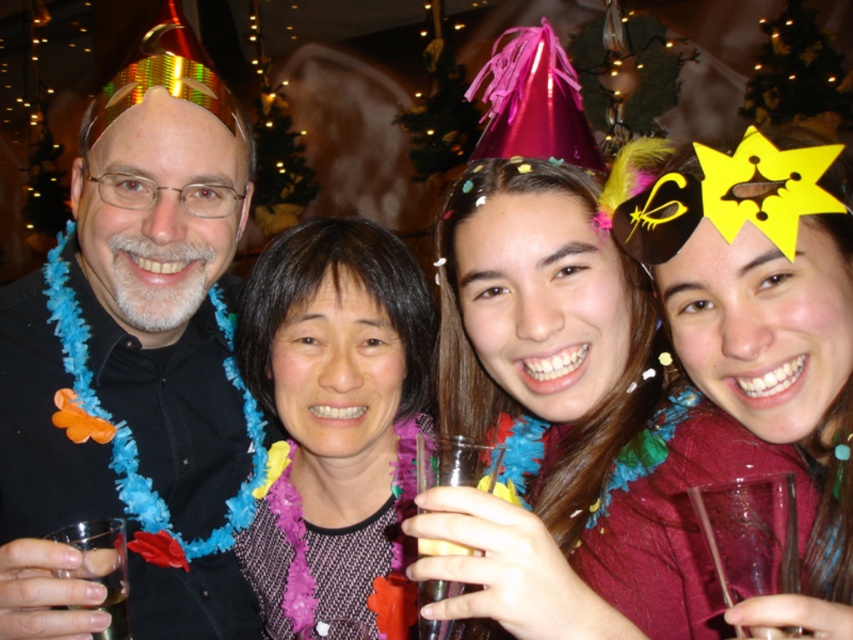
Question: Based on their relative distances, which object is nearer to the black fabric at center?

Choices:
 (A) translucent plastic cup at lower center
 (B) transparent plastic wine glass at lower right
 (C) matte black shirt at left

Answer: (C)

Question: Among these points, which one is farthest from the camera?

Choices:
 (A) (846, 368)
 (B) (363, 566)
 (C) (451, 544)

Answer: (B)

Question: Among these points, which one is nearest to the camera?

Choices:
 (A) (761, 314)
 (B) (126, 618)
 (C) (12, 612)
 (D) (287, 394)

Answer: (C)

Question: Is matte black shirt at left smaller than transparent plastic wine glass at lower right?

Choices:
 (A) yes
 (B) no

Answer: (B)

Question: Is matte black shirt at left below transparent plastic wine glass at lower right?

Choices:
 (A) yes
 (B) no

Answer: (B)

Question: Is translucent plastic cup at lower center further to camera compared to clear plastic glass at lower left?

Choices:
 (A) yes
 (B) no

Answer: (B)